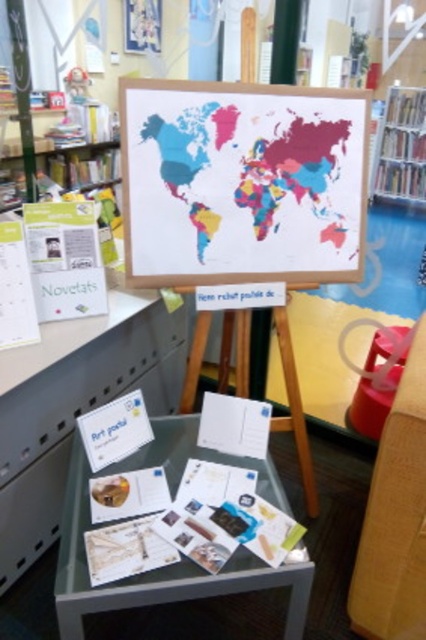
You are a visitor who wants to sit down while looking at the postcards on the glass table. Which seat should you choose between the smooth plastic chair at lower right and the matte plastic stool at lower right if you prefer a larger seat?

The smooth plastic chair at lower right is larger in size than the matte plastic stool at lower right, so you should choose the smooth plastic chair at lower right for a larger seat.